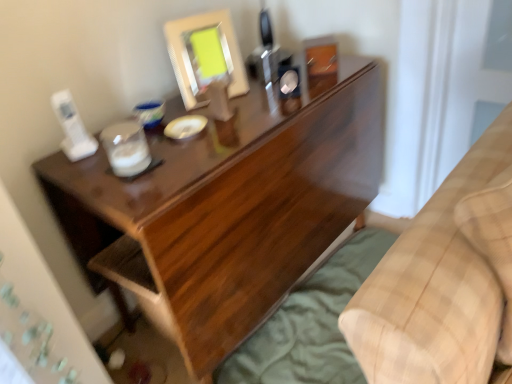
At what (x,y) coordinates should I click in order to perform the action: click on space that is in front of matte white frame at upper center. Please return your answer as a coordinate pair (x, y). The width and height of the screenshot is (512, 384). Looking at the image, I should click on (226, 114).